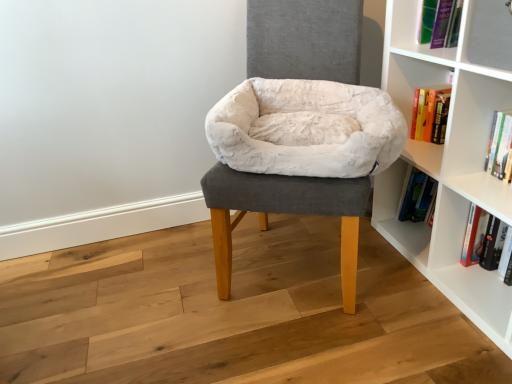
Question: Can you confirm if hardcover book at upper right, the 2th book ordered from the bottom, is smaller than white plush pet bed at center?

Choices:
 (A) yes
 (B) no

Answer: (A)

Question: Is hardcover book at upper right, the first book from the top, positioned far away from white plush pet bed at center?

Choices:
 (A) no
 (B) yes

Answer: (A)

Question: Considering the relative sizes of hardcover book at upper right, the first book from the top, and white plush pet bed at center in the image provided, is hardcover book at upper right, the first book from the top, bigger than white plush pet bed at center?

Choices:
 (A) no
 (B) yes

Answer: (A)

Question: From a real-world perspective, is hardcover book at upper right, the first book from the top, physically below white plush pet bed at center?

Choices:
 (A) no
 (B) yes

Answer: (A)

Question: Is hardcover book at upper right, the 2th book ordered from the bottom, further to camera compared to white plush pet bed at center?

Choices:
 (A) no
 (B) yes

Answer: (B)

Question: Would you say white plush pet bed at center is part of hardcover book at upper right, the 2th book ordered from the bottom,'s contents?

Choices:
 (A) yes
 (B) no

Answer: (B)

Question: From a real-world perspective, is hardcover book at lower right, which is the first book in bottom-to-top order, beneath white plush bean bag at center?

Choices:
 (A) no
 (B) yes

Answer: (B)

Question: Is hardcover book at lower right, which is counted as the 2th book, starting from the top, oriented away from white plush bean bag at center?

Choices:
 (A) no
 (B) yes

Answer: (A)

Question: Can you confirm if hardcover book at lower right, which is counted as the 2th book, starting from the top, is positioned to the left of white plush bean bag at center?

Choices:
 (A) no
 (B) yes

Answer: (A)

Question: From the image's perspective, is hardcover book at lower right, which is counted as the 2th book, starting from the top, under white plush bean bag at center?

Choices:
 (A) no
 (B) yes

Answer: (B)

Question: Considering the relative positions of hardcover book at lower right, which is the first book in bottom-to-top order, and white plush bean bag at center in the image provided, is hardcover book at lower right, which is the first book in bottom-to-top order, to the right of white plush bean bag at center from the viewer's perspective?

Choices:
 (A) yes
 (B) no

Answer: (A)

Question: Considering the relative sizes of hardcover book at lower right, which is counted as the 2th book, starting from the top, and white plush bean bag at center in the image provided, is hardcover book at lower right, which is counted as the 2th book, starting from the top, bigger than white plush bean bag at center?

Choices:
 (A) no
 (B) yes

Answer: (A)

Question: Is white plush pet bed at center wider than white plush bean bag at center?

Choices:
 (A) no
 (B) yes

Answer: (B)